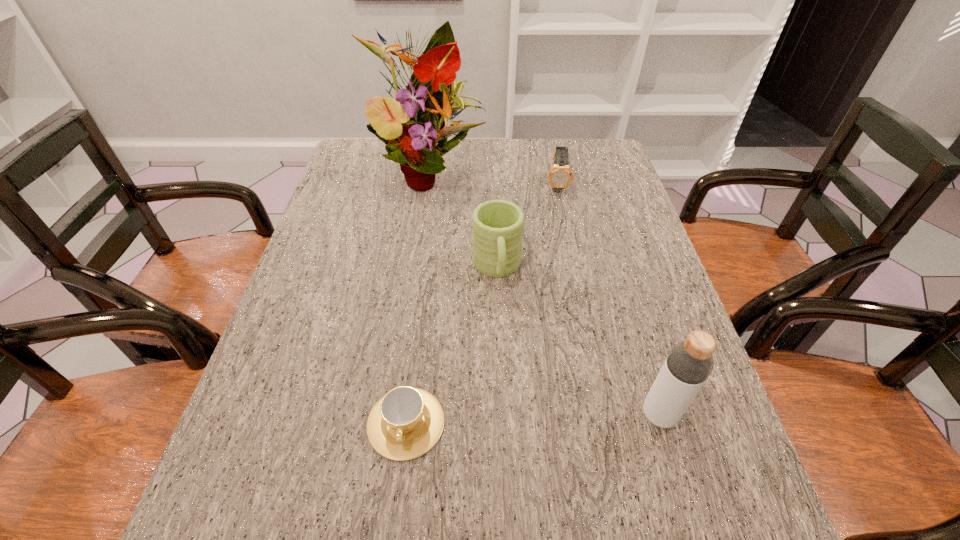
Where is `free space between the third shortest object and the tallest object`? free space between the third shortest object and the tallest object is located at coordinates (463, 220).

Point out which object is positioned as the third nearest to the fourth shortest object. Please provide its 2D coordinates. Your answer should be formatted as a tuple, i.e. [(x, y)], where the tuple contains the x and y coordinates of a point satisfying the conditions above.

[(560, 176)]

Identify the location of object that stands as the fourth closest to the tallest object. (689, 363).

Locate an element on the screen. The image size is (960, 540). free space that satisfies the following two spatial constraints: 1. on the front side of the third nearest object; 2. on the right side of the fourth shortest object is located at coordinates (502, 415).

At what (x,y) coordinates should I click in order to perform the action: click on free space that satisfies the following two spatial constraints: 1. on the front side of the watch; 2. on the right side of the second tallest object. Please return your answer as a coordinate pair (x, y). Image resolution: width=960 pixels, height=540 pixels. Looking at the image, I should click on (605, 415).

The width and height of the screenshot is (960, 540). I want to click on vacant space that satisfies the following two spatial constraints: 1. on the front side of the tallest object; 2. on the right side of the bottle, so click(x=394, y=415).

Locate an element on the screen. The image size is (960, 540). vacant space that satisfies the following two spatial constraints: 1. on the front side of the bottle; 2. on the right side of the tallest object is located at coordinates (394, 415).